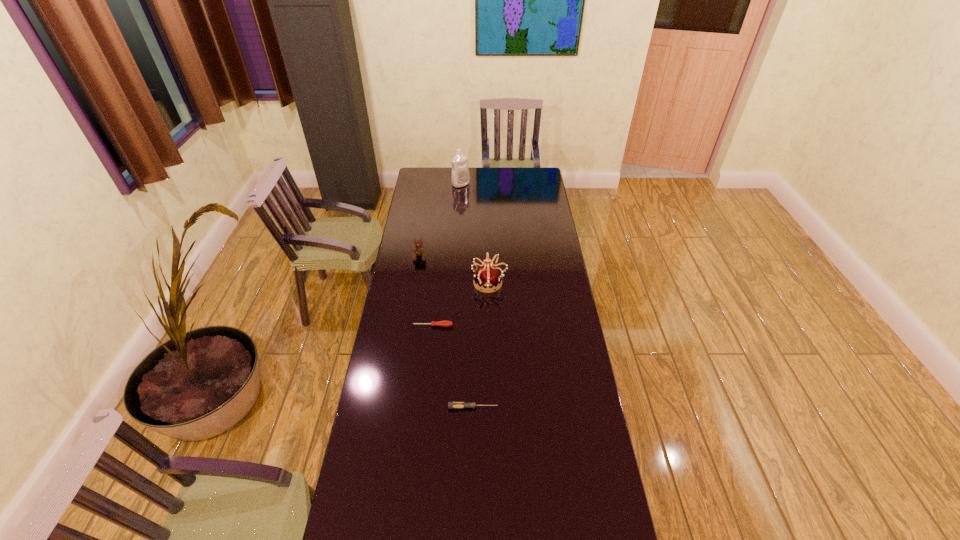
Where is `free location at the left edge of the desktop`? free location at the left edge of the desktop is located at coordinates (430, 236).

Where is `free location at the right edge of the desktop`? This screenshot has width=960, height=540. free location at the right edge of the desktop is located at coordinates (544, 193).

In the image, there is a desktop. Where is `vacant space at the far right corner`? This screenshot has width=960, height=540. vacant space at the far right corner is located at coordinates (541, 186).

This screenshot has height=540, width=960. I want to click on empty space between the farther screwdriver and the farthest object, so click(x=446, y=255).

Locate an element on the screen. The width and height of the screenshot is (960, 540). unoccupied area between the nearest object and the third tallest object is located at coordinates (446, 332).

Where is `free space between the farthest object and the fourth shortest object`? free space between the farthest object and the fourth shortest object is located at coordinates point(475,233).

Identify the location of vacant area that lies between the right screwdriver and the fourth shortest object. (481, 345).

Locate an element on the screen. The image size is (960, 540). free space between the fourth farthest object and the fourth shortest object is located at coordinates (461, 304).

Locate an element on the screen. blank region between the nearest object and the farther screwdriver is located at coordinates (452, 367).

Locate an element on the screen. This screenshot has height=540, width=960. free space that is in between the detergent and the tiara is located at coordinates (475, 233).